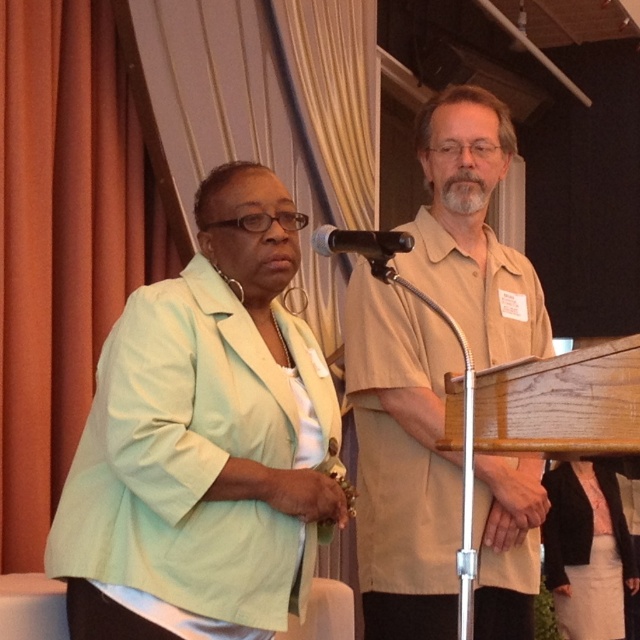
Between light green fabric jacket at left and beige shirt at center, which one appears on the right side from the viewer's perspective?

beige shirt at center

Who is lower down, light green fabric jacket at left or beige shirt at center?

light green fabric jacket at left

Between point (285, 472) and point (432, 500), which one is positioned in front?

Positioned in front is point (285, 472).

I want to click on light green fabric jacket at left, so click(204, 440).

Can you confirm if beige shirt at center is positioned to the right of black plastic microphone at upper center?

Correct, you'll find beige shirt at center to the right of black plastic microphone at upper center.

Does beige shirt at center have a larger size compared to black plastic microphone at upper center?

Yes, beige shirt at center is bigger than black plastic microphone at upper center.

Find the location of a particular element. Image resolution: width=640 pixels, height=640 pixels. beige shirt at center is located at coordinates (403, 461).

Find the location of a particular element. The image size is (640, 640). beige shirt at center is located at coordinates tap(403, 461).

Between light green fabric jacket at left and black plastic microphone at upper center, which one has more height?

light green fabric jacket at left is taller.

Is light green fabric jacket at left smaller than black plastic microphone at upper center?

Actually, light green fabric jacket at left might be larger than black plastic microphone at upper center.

The width and height of the screenshot is (640, 640). What do you see at coordinates (204, 440) in the screenshot?
I see `light green fabric jacket at left` at bounding box center [204, 440].

Identify the location of light green fabric jacket at left. (204, 440).